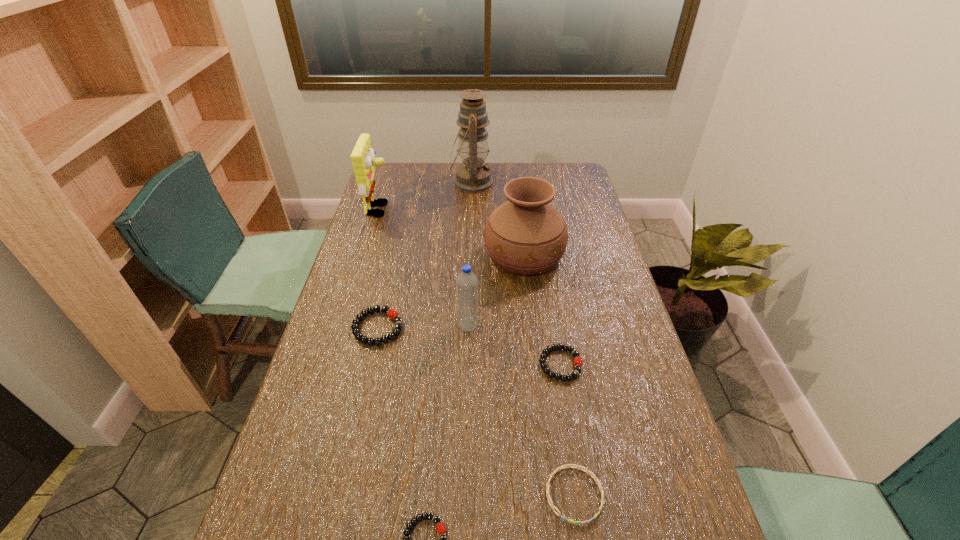
At what (x,y) coordinates should I click in order to perform the action: click on oil lamp. Please return your answer as a coordinate pair (x, y). Image resolution: width=960 pixels, height=540 pixels. Looking at the image, I should click on (473, 176).

Locate an element on the screen. This screenshot has height=540, width=960. brown oil lamp is located at coordinates (473, 176).

Where is `sponge`? This screenshot has height=540, width=960. sponge is located at coordinates (363, 159).

I want to click on urn, so click(x=526, y=235).

This screenshot has width=960, height=540. Identify the location of water bottle. (466, 282).

What are the coordinates of `blue water bottle` in the screenshot? It's located at click(x=466, y=282).

Where is `the leftmost black bracelet`? the leftmost black bracelet is located at coordinates (392, 314).

In order to click on the tallest bracelet in this screenshot , I will do `click(392, 314)`.

The image size is (960, 540). I want to click on the second smallest black bracelet, so click(x=578, y=362).

Identify the location of blue bracelet. (586, 470).